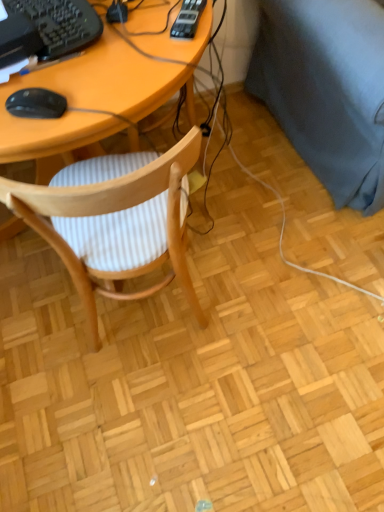
Locate an element on the screen. This screenshot has height=512, width=384. black matte mouse at left is located at coordinates (36, 104).

The height and width of the screenshot is (512, 384). Describe the element at coordinates (60, 24) in the screenshot. I see `black plastic keyboard at upper left` at that location.

I want to click on wooden chair with striped cushion at center, so click(114, 220).

This screenshot has height=512, width=384. In order to click on black matte mouse at left in this screenshot , I will do `click(36, 104)`.

Which of these two, dark blue fabric couch at right or black plastic keyboard at upper left, stands taller?

Standing taller between the two is dark blue fabric couch at right.

Is dark blue fabric couch at right looking in the opposite direction of black plastic keyboard at upper left?

No, black plastic keyboard at upper left is not at the back of dark blue fabric couch at right.

Based on the photo, relative to black plastic keyboard at upper left, is dark blue fabric couch at right in front or behind?

In the image, dark blue fabric couch at right appears behind black plastic keyboard at upper left.

Between point (324, 127) and point (69, 10), which one is positioned behind?

Positioned behind is point (324, 127).

Considering the positions of objects dark blue fabric couch at right and black matte mouse at left in the image provided, who is more to the left, dark blue fabric couch at right or black matte mouse at left?

black matte mouse at left is more to the left.

Is dark blue fabric couch at right oriented away from black matte mouse at left?

No, black matte mouse at left is not at the back of dark blue fabric couch at right.

Is the depth of dark blue fabric couch at right greater than that of black matte mouse at left?

That is True.

Are dark blue fabric couch at right and black matte mouse at left located far from each other?

That's not correct — dark blue fabric couch at right is a little close to black matte mouse at left.

Which is further, (31, 96) or (62, 50)?

The point (62, 50) is more distant.

Is black matte mouse at left directly adjacent to black plastic keyboard at upper left?

No, black matte mouse at left is not in contact with black plastic keyboard at upper left.

Where is `computer keyboard behind the black matte mouse at left`? computer keyboard behind the black matte mouse at left is located at coordinates (60, 24).

Is black plastic keyboard at upper left thinner than dark blue fabric couch at right?

Yes.

Which point is more forward, (x=79, y=0) or (x=301, y=97)?

The point (x=79, y=0) is in front.

Is black plastic keyboard at upper left inside the boundaries of dark blue fabric couch at right, or outside?

black plastic keyboard at upper left lies outside dark blue fabric couch at right.

Which of these two, black plastic keyboard at upper left or dark blue fabric couch at right, stands taller?

dark blue fabric couch at right.

From a real-world perspective, who is located lower, wooden chair with striped cushion at center or black matte mouse at left?

In real-world perspective, wooden chair with striped cushion at center is lower.

Is there a large distance between wooden chair with striped cushion at center and black matte mouse at left?

wooden chair with striped cushion at center is near black matte mouse at left, not far away.

Is wooden chair with striped cushion at center oriented towards black matte mouse at left?

No, wooden chair with striped cushion at center is not oriented towards black matte mouse at left.

Is black matte mouse at left to the left of wooden chair with striped cushion at center from the viewer's perspective?

Indeed, black matte mouse at left is positioned on the left side of wooden chair with striped cushion at center.

How much distance is there between black matte mouse at left and wooden chair with striped cushion at center?

A distance of 12.61 inches exists between black matte mouse at left and wooden chair with striped cushion at center.

Is there a large distance between black matte mouse at left and wooden chair with striped cushion at center?

That's not correct — black matte mouse at left is a little close to wooden chair with striped cushion at center.

Is black matte mouse at left facing towards wooden chair with striped cushion at center?

Yes, black matte mouse at left is turned towards wooden chair with striped cushion at center.

Which object is positioned more to the left, black plastic keyboard at upper left or black matte mouse at left?

From the viewer's perspective, black plastic keyboard at upper left appears more on the left side.

Based on their sizes in the image, would you say black plastic keyboard at upper left is bigger or smaller than black matte mouse at left?

Considering their sizes, black plastic keyboard at upper left takes up more space than black matte mouse at left.

Is point (61, 27) positioned before point (58, 110)?

No, (61, 27) is further to viewer.

Is black plastic keyboard at upper left aimed at black matte mouse at left?

No, black plastic keyboard at upper left is not facing towards black matte mouse at left.

Find the location of a particular element. The height and width of the screenshot is (512, 384). couch above the black plastic keyboard at upper left (from the image's perspective) is located at coordinates (327, 90).

The image size is (384, 512). I want to click on couch to the right of black matte mouse at left, so click(x=327, y=90).

From the image, which object appears to be nearer to black plastic keyboard at upper left, black matte mouse at left or wooden chair with striped cushion at center?

black matte mouse at left is closer to black plastic keyboard at upper left.

Consider the image. Estimate the real-world distances between objects in this image. Which object is closer to wooden chair with striped cushion at center, dark blue fabric couch at right or black plastic keyboard at upper left?

black plastic keyboard at upper left is closer to wooden chair with striped cushion at center.

In the scene shown: Considering their positions, is dark blue fabric couch at right positioned further to black plastic keyboard at upper left than black matte mouse at left?

Among the two, dark blue fabric couch at right is located further to black plastic keyboard at upper left.

Based on their spatial positions, is black plastic keyboard at upper left or black matte mouse at left further from dark blue fabric couch at right?

Among the two, black matte mouse at left is located further to dark blue fabric couch at right.

Consider the image. Considering their positions, is black matte mouse at left positioned further to dark blue fabric couch at right than black plastic keyboard at upper left?

Based on the image, black matte mouse at left appears to be further to dark blue fabric couch at right.

Which object lies nearer to the anchor point wooden chair with striped cushion at center, black matte mouse at left or dark blue fabric couch at right?

black matte mouse at left is closer to wooden chair with striped cushion at center.

Based on their spatial positions, is black plastic keyboard at upper left or wooden chair with striped cushion at center closer to dark blue fabric couch at right?

The object closer to dark blue fabric couch at right is wooden chair with striped cushion at center.

Which object lies nearer to the anchor point black matte mouse at left, dark blue fabric couch at right or wooden chair with striped cushion at center?

wooden chair with striped cushion at center lies closer to black matte mouse at left than the other object.

Locate an element on the screen. This screenshot has height=512, width=384. chair situated between black matte mouse at left and dark blue fabric couch at right from left to right is located at coordinates (114, 220).

At what (x,y) coordinates should I click in order to perform the action: click on chair between black plastic keyboard at upper left and dark blue fabric couch at right from left to right. Please return your answer as a coordinate pair (x, y). This screenshot has height=512, width=384. Looking at the image, I should click on (114, 220).

Locate an element on the screen. The width and height of the screenshot is (384, 512). mouse located between black plastic keyboard at upper left and dark blue fabric couch at right in the left-right direction is located at coordinates (36, 104).

Identify the location of mouse that lies between black plastic keyboard at upper left and wooden chair with striped cushion at center from top to bottom. (36, 104).